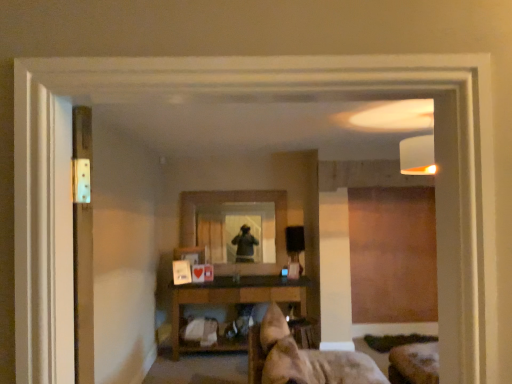
Question: Choose the correct answer: Is clear glass mirror at center inside brown wooden shelf at center or outside it?

Choices:
 (A) inside
 (B) outside

Answer: (B)

Question: Looking at the image, does clear glass mirror at center seem bigger or smaller compared to brown wooden shelf at center?

Choices:
 (A) small
 (B) big

Answer: (A)

Question: Estimate the real-world distances between objects in this image. Which object is closer to the metallic silver screen door at left?

Choices:
 (A) clear glass mirror at center
 (B) brown wooden shelf at center

Answer: (B)

Question: Estimate the real-world distances between objects in this image. Which object is farther from the metallic silver screen door at left?

Choices:
 (A) brown wooden shelf at center
 (B) clear glass mirror at center

Answer: (B)